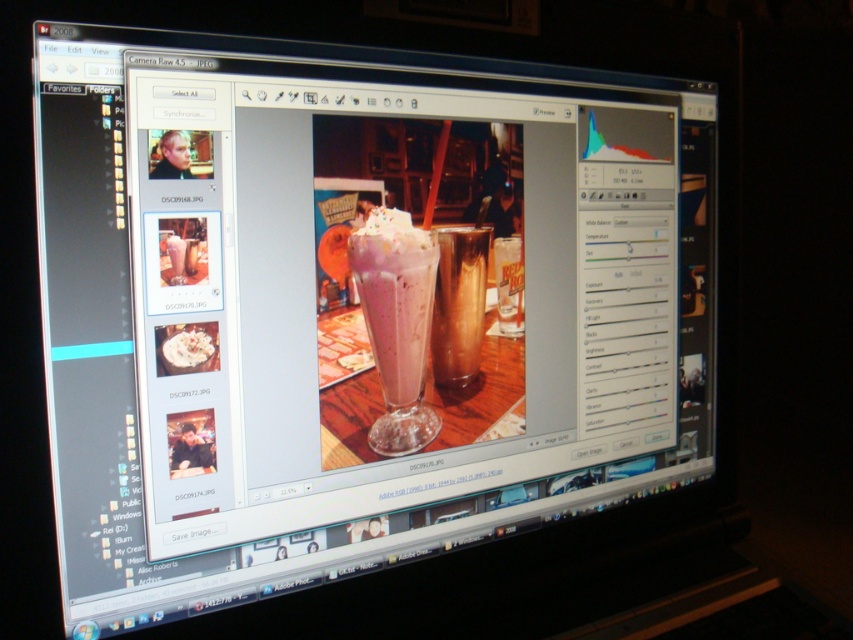
Is point (422, 432) farther from viewer compared to point (442, 301)?

No, it is not.

Does pink frosted glass at center have a lesser width compared to brown glass at center?

Incorrect, pink frosted glass at center's width is not less than brown glass at center's.

The image size is (853, 640). I want to click on pink frosted glass at center, so click(x=395, y=301).